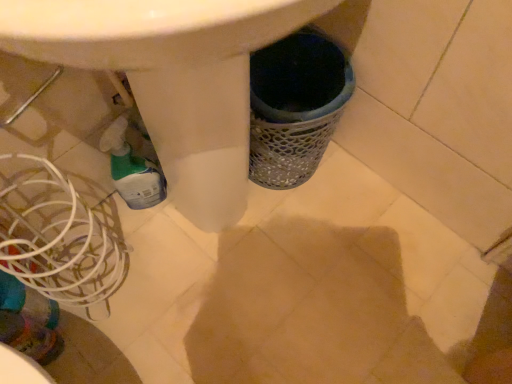
Where is `translucent plastic bottle at lower left`? translucent plastic bottle at lower left is located at coordinates (132, 169).

What is the approximate height of translucent plastic bottle at lower left?

translucent plastic bottle at lower left is 11.21 inches tall.

Describe the element at coordinates (132, 169) in the screenshot. I see `translucent plastic bottle at lower left` at that location.

The height and width of the screenshot is (384, 512). Find the location of `white wire basket at lower left`. white wire basket at lower left is located at coordinates (59, 240).

Describe the element at coordinates (59, 240) in the screenshot. This screenshot has height=384, width=512. I see `white wire basket at lower left` at that location.

Find the location of `translucent plastic bottle at lower left`. translucent plastic bottle at lower left is located at coordinates (132, 169).

Which is more to the left, white wire basket at lower left or translucent plastic bottle at lower left?

white wire basket at lower left is more to the left.

Is white wire basket at lower left positioned in front of translucent plastic bottle at lower left?

Yes, it is.

Is point (104, 296) closer or farther from the camera than point (127, 164)?

Clearly, point (104, 296) is more distant from the camera than point (127, 164).

From the image's perspective, is white wire basket at lower left positioned above or below translucent plastic bottle at lower left?

Clearly, from the image's perspective, white wire basket at lower left is below translucent plastic bottle at lower left.

From a real-world perspective, is white wire basket at lower left positioned above or below translucent plastic bottle at lower left?

From a real-world perspective, white wire basket at lower left is physically above translucent plastic bottle at lower left.

Is white wire basket at lower left wider than translucent plastic bottle at lower left?

Indeed, white wire basket at lower left has a greater width compared to translucent plastic bottle at lower left.

Can you confirm if white wire basket at lower left is taller than translucent plastic bottle at lower left?

Yes, white wire basket at lower left is taller than translucent plastic bottle at lower left.

Which of these two, white wire basket at lower left or translucent plastic bottle at lower left, is bigger?

Bigger between the two is white wire basket at lower left.

Can translucent plastic bottle at lower left be found inside white wire basket at lower left?

That's incorrect, translucent plastic bottle at lower left is not inside white wire basket at lower left.

Is the surface of white wire basket at lower left in direct contact with translucent plastic bottle at lower left?

No, white wire basket at lower left is not beside translucent plastic bottle at lower left.

Could you tell me if white wire basket at lower left is facing translucent plastic bottle at lower left?

No, white wire basket at lower left is not facing towards translucent plastic bottle at lower left.

In the scene shown: Measure the distance from white wire basket at lower left to translucent plastic bottle at lower left.

white wire basket at lower left is 6.46 inches from translucent plastic bottle at lower left.

Where is `bottle located above the white wire basket at lower left (from the image's perspective)`? The image size is (512, 384). bottle located above the white wire basket at lower left (from the image's perspective) is located at coordinates (132, 169).

Can you confirm if translucent plastic bottle at lower left is positioned to the left of white wire basket at lower left?

No.

Between translucent plastic bottle at lower left and white wire basket at lower left, which one is positioned behind?

translucent plastic bottle at lower left is further away from the camera.

Which is nearer, (x=142, y=188) or (x=92, y=219)?

→ Point (x=142, y=188) appears to be farther away from the viewer than point (x=92, y=219).

From the image's perspective, who appears lower, translucent plastic bottle at lower left or white wire basket at lower left?

white wire basket at lower left, from the image's perspective.

From a real-world perspective, between translucent plastic bottle at lower left and white wire basket at lower left, who is vertically lower?

translucent plastic bottle at lower left is physically lower.

Which of these two, translucent plastic bottle at lower left or white wire basket at lower left, is wider?

With larger width is white wire basket at lower left.

Considering the relative sizes of translucent plastic bottle at lower left and white wire basket at lower left in the image provided, is translucent plastic bottle at lower left taller than white wire basket at lower left?

In fact, translucent plastic bottle at lower left may be shorter than white wire basket at lower left.

Looking at the image, does translucent plastic bottle at lower left seem bigger or smaller compared to white wire basket at lower left?

Clearly, translucent plastic bottle at lower left is smaller in size than white wire basket at lower left.

Choose the correct answer: Is translucent plastic bottle at lower left inside white wire basket at lower left or outside it?

translucent plastic bottle at lower left is not inside white wire basket at lower left, it's outside.

Is translucent plastic bottle at lower left next to white wire basket at lower left and touching it?

No, translucent plastic bottle at lower left is not making contact with white wire basket at lower left.

Could you tell me if translucent plastic bottle at lower left is turned towards white wire basket at lower left?

No, translucent plastic bottle at lower left is not turned towards white wire basket at lower left.

Where is `bottle above the white wire basket at lower left (from the image's perspective)`? The width and height of the screenshot is (512, 384). bottle above the white wire basket at lower left (from the image's perspective) is located at coordinates (132, 169).

Find the location of a particular element. Image resolution: width=512 pixels, height=384 pixels. bottle that appears above the white wire basket at lower left (from the image's perspective) is located at coordinates (132, 169).

Find the location of a particular element. The width and height of the screenshot is (512, 384). basket on the left of translucent plastic bottle at lower left is located at coordinates (59, 240).